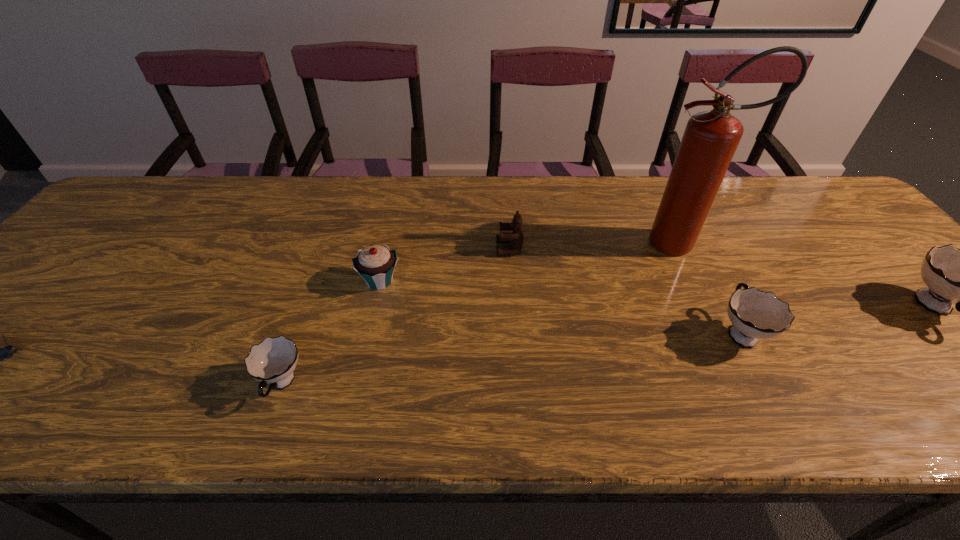
In order to click on the second object from left to right in this screenshot , I will do click(273, 361).

Where is `the shortest cup`? The width and height of the screenshot is (960, 540). the shortest cup is located at coordinates (273, 361).

At what (x,y) coordinates should I click in order to perform the action: click on the second cup from right to left. Please return your answer as a coordinate pair (x, y). This screenshot has width=960, height=540. Looking at the image, I should click on (754, 314).

The width and height of the screenshot is (960, 540). Find the location of `the fifth object from right to left`. the fifth object from right to left is located at coordinates (375, 264).

This screenshot has width=960, height=540. Find the location of `the fourth object from left to right`. the fourth object from left to right is located at coordinates (516, 238).

The image size is (960, 540). What are the coordinates of `the tallest object` in the screenshot? It's located at [710, 139].

Where is `vacant space located 0.340m on the side of the second cup from left to right with the handle`? Image resolution: width=960 pixels, height=540 pixels. vacant space located 0.340m on the side of the second cup from left to right with the handle is located at coordinates (680, 217).

I want to click on free region located on the side of the second cup from left to right with the handle, so click(708, 273).

At what (x,y) coordinates should I click in order to perform the action: click on free space located 0.340m on the side of the second cup from left to right with the handle. Please return your answer as a coordinate pair (x, y). The image size is (960, 540). Looking at the image, I should click on pos(680,217).

Locate an element on the screen. This screenshot has height=540, width=960. vacant position located on the left of the cupcake is located at coordinates (243, 281).